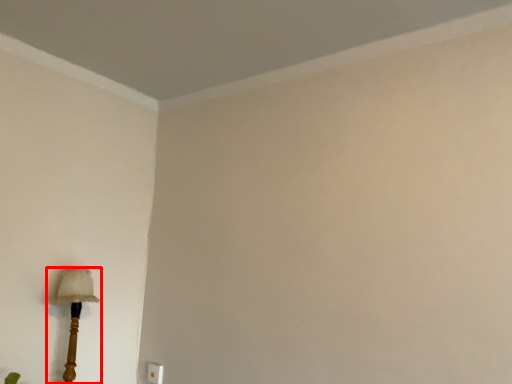
Question: Where is lamp (annotated by the red box) located in relation to electric outlet in the image?

Choices:
 (A) left
 (B) right

Answer: (A)